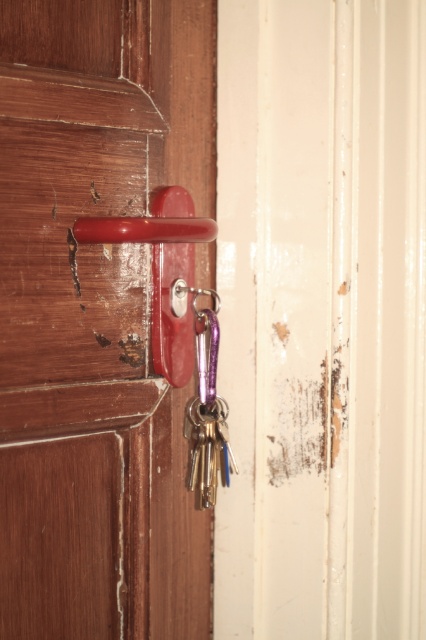
The width and height of the screenshot is (426, 640). Describe the element at coordinates (163, 272) in the screenshot. I see `rubberized red door handle at center` at that location.

Which of these two, rubberized red door handle at center or purple metallic key at center, stands taller?

With more height is purple metallic key at center.

Between point (167, 291) and point (224, 474), which one is positioned in front?

Point (167, 291)

Where is `rubberized red door handle at center`? The image size is (426, 640). rubberized red door handle at center is located at coordinates (163, 272).

Is matte plastic handle at center thinner than rubberized red door handle at center?

No, matte plastic handle at center is not thinner than rubberized red door handle at center.

Describe the element at coordinates (97, 317) in the screenshot. I see `matte plastic handle at center` at that location.

Is point (209, 188) closer to viewer compared to point (215, 224)?

No.

Find the location of a particular element. matte plastic handle at center is located at coordinates (97, 317).

Is matte plastic handle at center in front of purple metallic key at center?

That is True.

Is point (57, 636) farther from camera compared to point (207, 339)?

No, (57, 636) is closer to viewer.

Is point (5, 586) positioned behind point (204, 413)?

No, (5, 586) is in front of (204, 413).

The width and height of the screenshot is (426, 640). In order to click on matte plastic handle at center in this screenshot , I will do `click(97, 317)`.